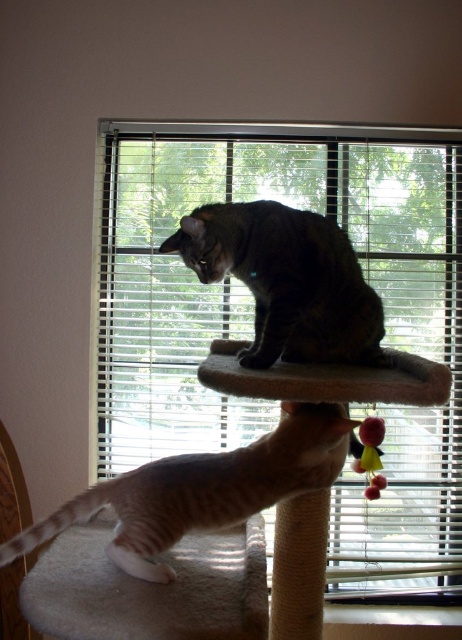
Question: Which of the following is the farthest from the observer?

Choices:
 (A) white blinds at center
 (B) beige carpeted stool at center
 (C) gray striped cat at center

Answer: (A)

Question: Does white blinds at center have a smaller size compared to gray striped cat at center?

Choices:
 (A) yes
 (B) no

Answer: (B)

Question: Can you confirm if white blinds at center is positioned below gray striped cat at center?

Choices:
 (A) yes
 (B) no

Answer: (B)

Question: Does beige carpeted stool at center appear on the right side of gray striped cat at center?

Choices:
 (A) no
 (B) yes

Answer: (B)

Question: Which of the following is the closest to the observer?

Choices:
 (A) gray striped cat at center
 (B) dark gray fur cat at center
 (C) white blinds at center

Answer: (A)

Question: Among these objects, which one is farthest from the camera?

Choices:
 (A) white blinds at center
 (B) gray striped cat at center
 (C) beige carpeted stool at center

Answer: (A)